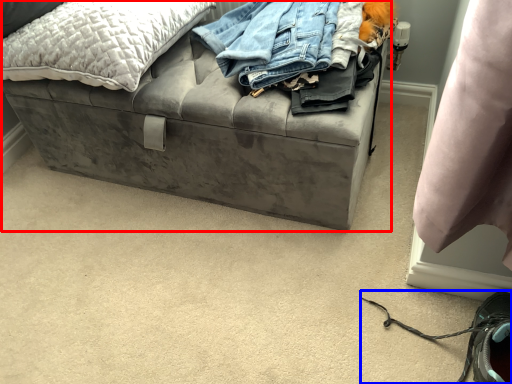
Question: Which object appears closest to the camera in this image, furniture (highlighted by a red box) or shoe (highlighted by a blue box)?

Choices:
 (A) furniture
 (B) shoe

Answer: (B)